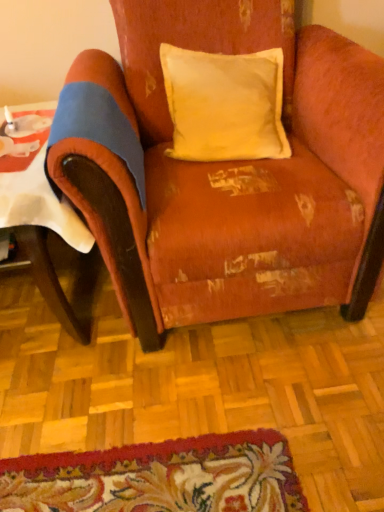
Question: Is worn velvet armchair at center taller than white paper at left?

Choices:
 (A) yes
 (B) no

Answer: (A)

Question: Is the position of worn velvet armchair at center less distant than that of white paper at left?

Choices:
 (A) yes
 (B) no

Answer: (A)

Question: Is worn velvet armchair at center not within white paper at left?

Choices:
 (A) yes
 (B) no

Answer: (A)

Question: Is worn velvet armchair at center not close to white paper at left?

Choices:
 (A) yes
 (B) no

Answer: (B)

Question: From the image's perspective, does worn velvet armchair at center appear higher than white paper at left?

Choices:
 (A) no
 (B) yes

Answer: (B)

Question: Does worn velvet armchair at center have a smaller size compared to white paper at left?

Choices:
 (A) yes
 (B) no

Answer: (B)

Question: Is yellow velvet pillow at upper center located outside white paper at left?

Choices:
 (A) no
 (B) yes

Answer: (B)

Question: From a real-world perspective, is yellow velvet pillow at upper center physically below white paper at left?

Choices:
 (A) yes
 (B) no

Answer: (B)

Question: Does yellow velvet pillow at upper center have a smaller size compared to white paper at left?

Choices:
 (A) yes
 (B) no

Answer: (A)

Question: Can you confirm if yellow velvet pillow at upper center is thinner than white paper at left?

Choices:
 (A) yes
 (B) no

Answer: (A)

Question: From the image's perspective, is yellow velvet pillow at upper center below white paper at left?

Choices:
 (A) yes
 (B) no

Answer: (B)

Question: Is white paper at left located within yellow velvet pillow at upper center?

Choices:
 (A) yes
 (B) no

Answer: (B)

Question: From a real-world perspective, is white paper at left located higher than worn velvet armchair at center?

Choices:
 (A) no
 (B) yes

Answer: (A)